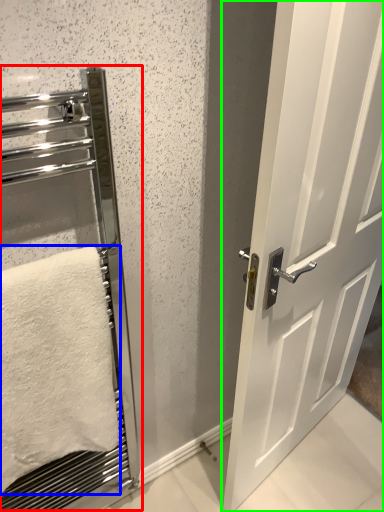
Question: Which is farther away from elevator (highlighted by a red box)? towel (highlighted by a blue box) or door (highlighted by a green box)?

Choices:
 (A) towel
 (B) door

Answer: (B)